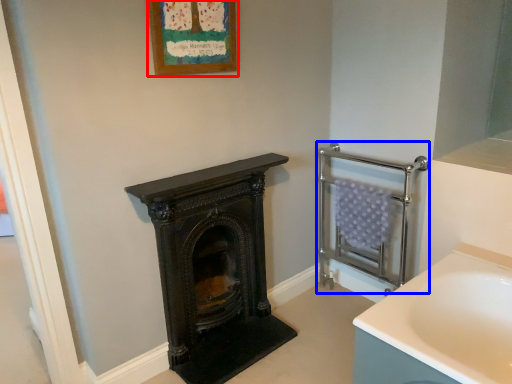
Question: Which object appears closest to the camera in this image, picture frame (highlighted by a red box) or balustrade (highlighted by a blue box)?

Choices:
 (A) picture frame
 (B) balustrade

Answer: (A)